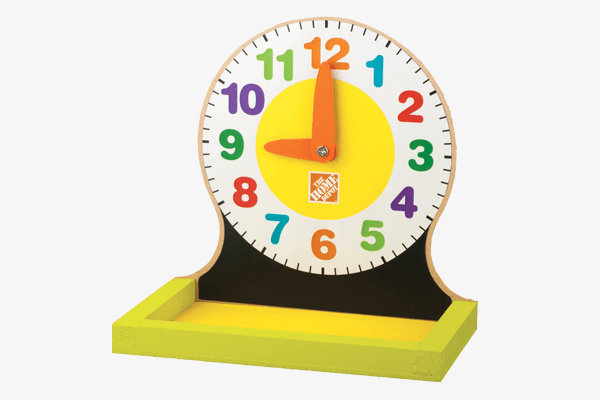
Identify the location of orange plastic clock hands. (320, 109), (287, 146).